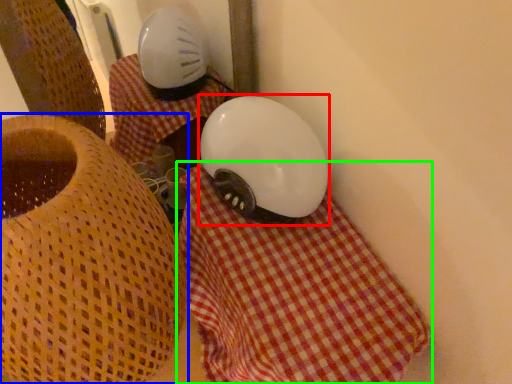
Question: Considering the real-world distances, which object is farthest from helmet (highlighted by a red box)? furniture (highlighted by a blue box) or blanket (highlighted by a green box)?

Choices:
 (A) furniture
 (B) blanket

Answer: (A)